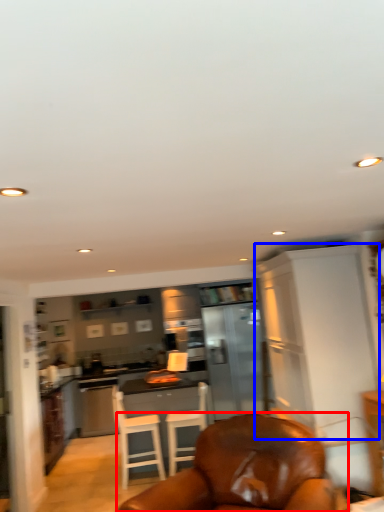
Question: Which object is closer to the camera taking this photo, chair (highlighted by a red box) or cabinetry (highlighted by a blue box)?

Choices:
 (A) chair
 (B) cabinetry

Answer: (A)